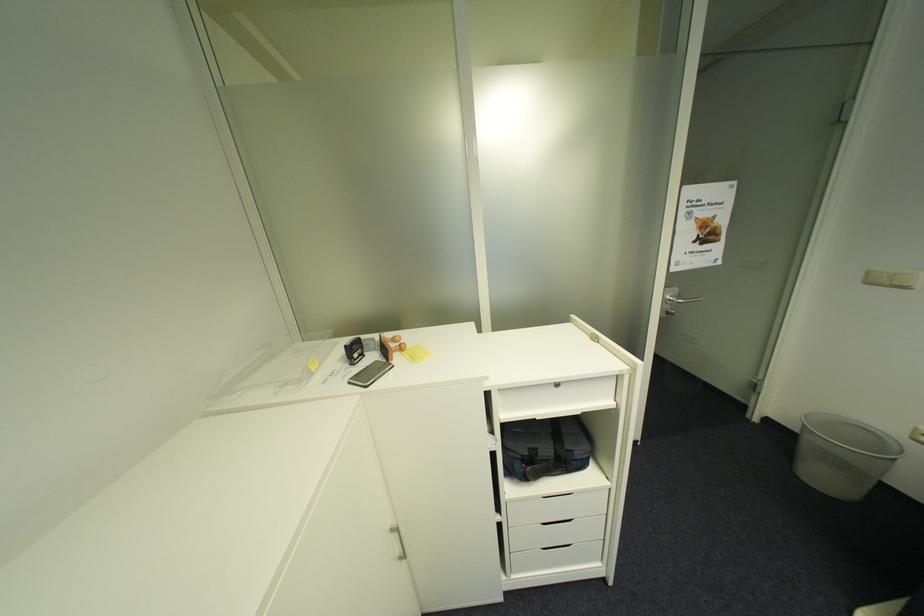
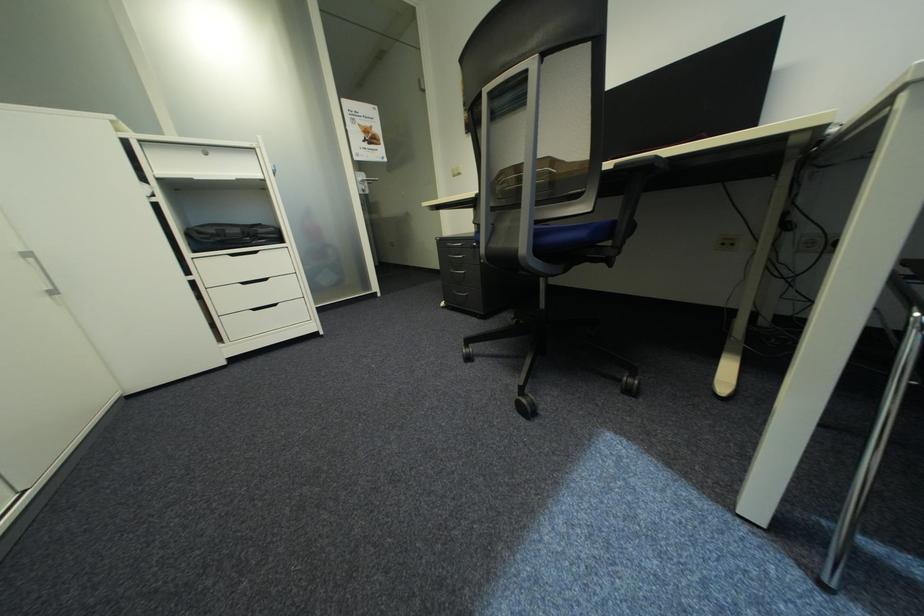
Find the pixel in the second image that matches point 407,553 in the first image.

(55, 288)